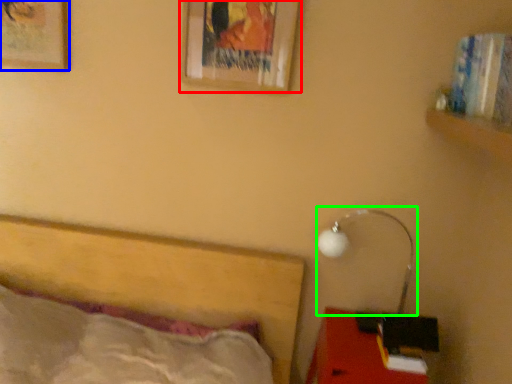
Question: Which object is the closest to the picture frame (highlighted by a red box)? Choose among these: picture frame (highlighted by a blue box) or lamp (highlighted by a green box).

Choices:
 (A) picture frame
 (B) lamp

Answer: (A)